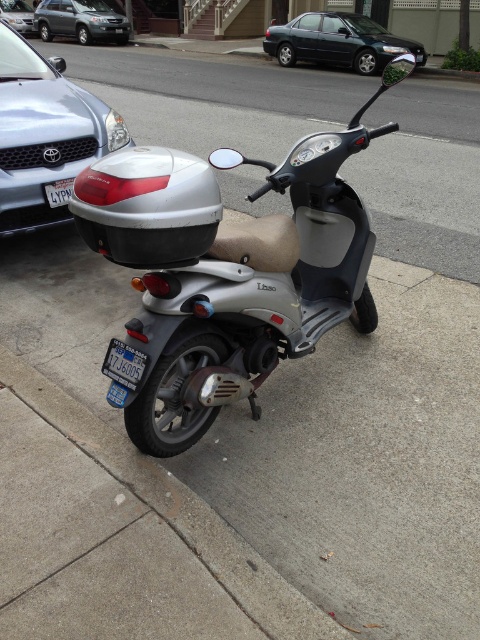
Can you confirm if metallic silver sedan at left is wider than silver metallic suv at upper left?

Incorrect, metallic silver sedan at left's width does not surpass silver metallic suv at upper left's.

Who is lower down, metallic silver sedan at left or silver metallic suv at upper left?

Positioned lower is metallic silver sedan at left.

Is point (95, 132) less distant than point (128, 32)?

Yes, point (95, 132) is closer to viewer.

Where is `metallic silver sedan at left`? The height and width of the screenshot is (640, 480). metallic silver sedan at left is located at coordinates (45, 132).

Is metallic silver sedan at left shorter than blue metallic license plate at lower center?

Incorrect, metallic silver sedan at left's height does not fall short of blue metallic license plate at lower center's.

Which is below, metallic silver sedan at left or blue metallic license plate at lower center?

blue metallic license plate at lower center

Who is more distant from viewer, (x=24, y=132) or (x=142, y=374)?

The point (x=24, y=132) is behind.

This screenshot has height=640, width=480. I want to click on metallic silver sedan at left, so click(45, 132).

Does metallic blue sedan at center appear over silver metallic sedan at upper left?

No.

Is point (312, 33) positioned after point (20, 19)?

No, it is not.

Where is `metallic blue sedan at center`? The image size is (480, 640). metallic blue sedan at center is located at coordinates (337, 42).